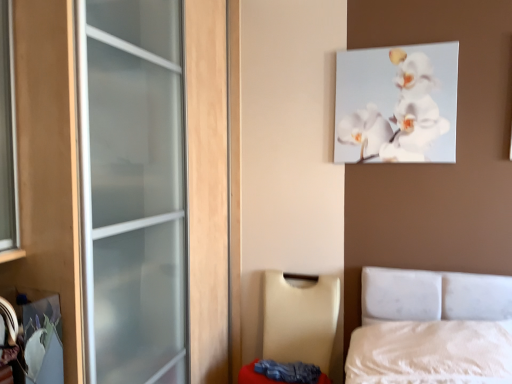
Question: Does beige leather chair at lower center have a lesser width compared to white glossy orchid at upper center?

Choices:
 (A) no
 (B) yes

Answer: (A)

Question: From a real-world perspective, is beige leather chair at lower center below white glossy orchid at upper center?

Choices:
 (A) yes
 (B) no

Answer: (A)

Question: Can you confirm if beige leather chair at lower center is shorter than white glossy orchid at upper center?

Choices:
 (A) no
 (B) yes

Answer: (A)

Question: Does beige leather chair at lower center have a smaller size compared to white glossy orchid at upper center?

Choices:
 (A) no
 (B) yes

Answer: (A)

Question: From the image's perspective, is beige leather chair at lower center above white glossy orchid at upper center?

Choices:
 (A) no
 (B) yes

Answer: (A)

Question: Is white fabric mattress at lower right wider or thinner than white glossy orchid at upper center?

Choices:
 (A) wide
 (B) thin

Answer: (A)

Question: Would you say white fabric mattress at lower right is inside or outside white glossy orchid at upper center?

Choices:
 (A) inside
 (B) outside

Answer: (B)

Question: Is point (254, 372) positioned closer to the camera than point (456, 46)?

Choices:
 (A) farther
 (B) closer

Answer: (A)

Question: Considering the positions of white fabric mattress at lower right and white glossy orchid at upper center in the image, is white fabric mattress at lower right bigger or smaller than white glossy orchid at upper center?

Choices:
 (A) big
 (B) small

Answer: (A)

Question: Choose the correct answer: Is white glossy orchid at upper center inside white fabric mattress at lower right or outside it?

Choices:
 (A) outside
 (B) inside

Answer: (A)

Question: Relative to white fabric mattress at lower right, is white glossy orchid at upper center in front or behind?

Choices:
 (A) front
 (B) behind

Answer: (B)

Question: Does point (394, 135) appear closer or farther from the camera than point (326, 382)?

Choices:
 (A) closer
 (B) farther

Answer: (A)

Question: From a real-world perspective, is white glossy orchid at upper center positioned above or below white fabric mattress at lower right?

Choices:
 (A) above
 (B) below

Answer: (A)

Question: Is beige leather chair at lower center to the left or to the right of white fabric mattress at lower right in the image?

Choices:
 (A) left
 (B) right

Answer: (A)

Question: Considering their positions, is beige leather chair at lower center located in front of or behind white fabric mattress at lower right?

Choices:
 (A) front
 (B) behind

Answer: (A)